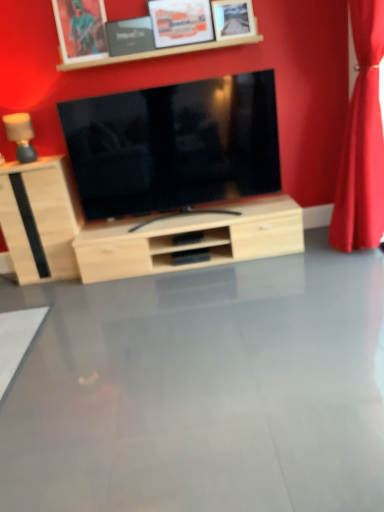
Question: Does matte black tv at center have a larger size compared to brushed metal picture frame at upper center, the first picture frame from the left?

Choices:
 (A) yes
 (B) no

Answer: (A)

Question: Is matte black tv at center facing towards brushed metal picture frame at upper center, the first picture frame from the left?

Choices:
 (A) no
 (B) yes

Answer: (A)

Question: Considering the relative sizes of matte black tv at center and brushed metal picture frame at upper center, which appears as the 4th picture frame when viewed from the right, in the image provided, is matte black tv at center wider than brushed metal picture frame at upper center, which appears as the 4th picture frame when viewed from the right,?

Choices:
 (A) yes
 (B) no

Answer: (A)

Question: Is matte black tv at center positioned in front of brushed metal picture frame at upper center, the first picture frame from the left?

Choices:
 (A) no
 (B) yes

Answer: (B)

Question: Does matte black tv at center appear on the right side of brushed metal picture frame at upper center, the first picture frame from the left?

Choices:
 (A) no
 (B) yes

Answer: (B)

Question: Is matte black tv at center taller than brushed metal picture frame at upper center, which appears as the 4th picture frame when viewed from the right?

Choices:
 (A) yes
 (B) no

Answer: (A)

Question: Considering the relative sizes of red velvet curtain at right and wooden frame at upper center in the image provided, is red velvet curtain at right wider than wooden frame at upper center?

Choices:
 (A) no
 (B) yes

Answer: (B)

Question: Does red velvet curtain at right lie in front of wooden frame at upper center?

Choices:
 (A) yes
 (B) no

Answer: (A)

Question: Are red velvet curtain at right and wooden frame at upper center far apart?

Choices:
 (A) no
 (B) yes

Answer: (B)

Question: Can you confirm if red velvet curtain at right is thinner than wooden frame at upper center?

Choices:
 (A) yes
 (B) no

Answer: (B)

Question: Can you see red velvet curtain at right touching wooden frame at upper center?

Choices:
 (A) no
 (B) yes

Answer: (A)

Question: Is red velvet curtain at right shorter than wooden frame at upper center?

Choices:
 (A) yes
 (B) no

Answer: (B)

Question: Is brushed metal picture frame at upper center, the first picture frame from the left, with matte wood lamp at left?

Choices:
 (A) no
 (B) yes

Answer: (A)